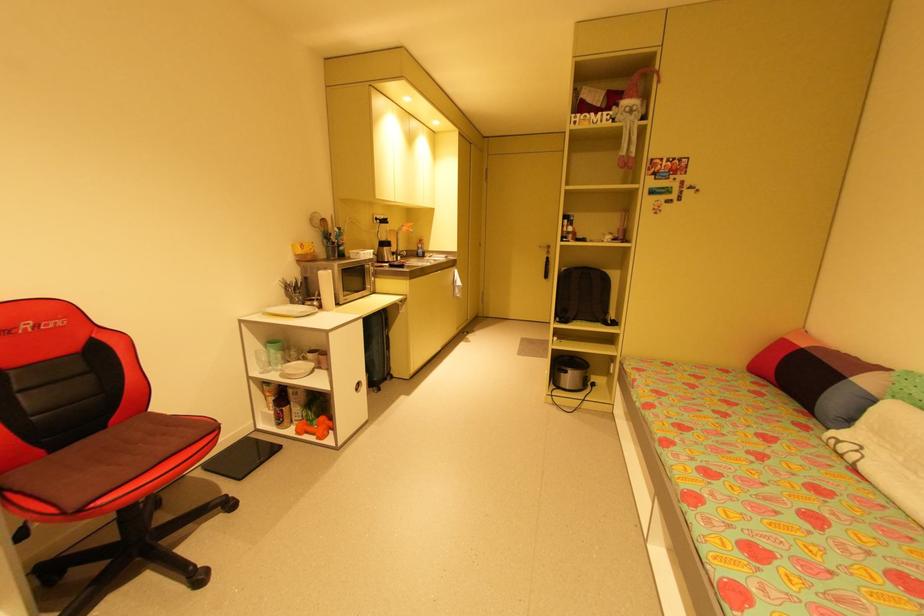
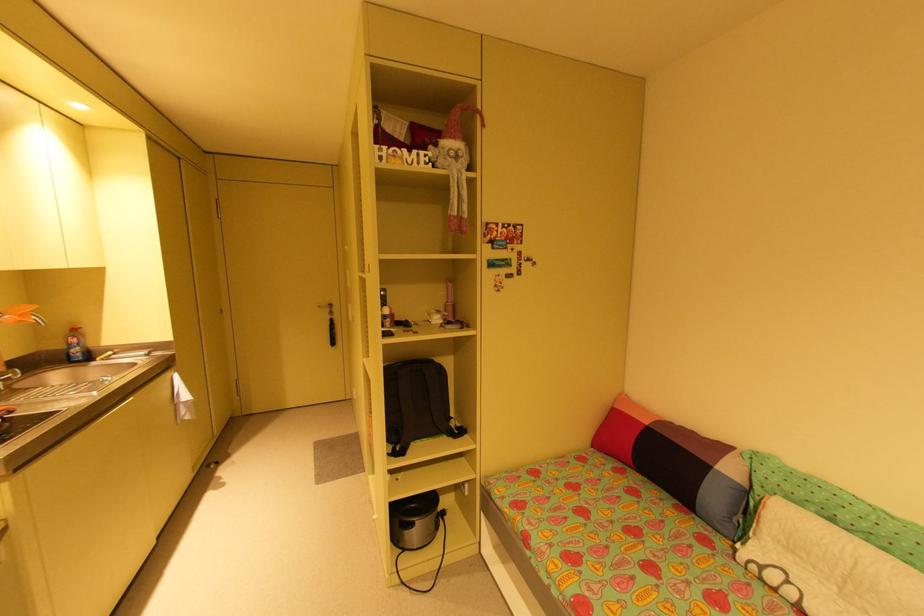
In the second image, find the point that corresponds to point (426, 241) in the first image.

(79, 331)